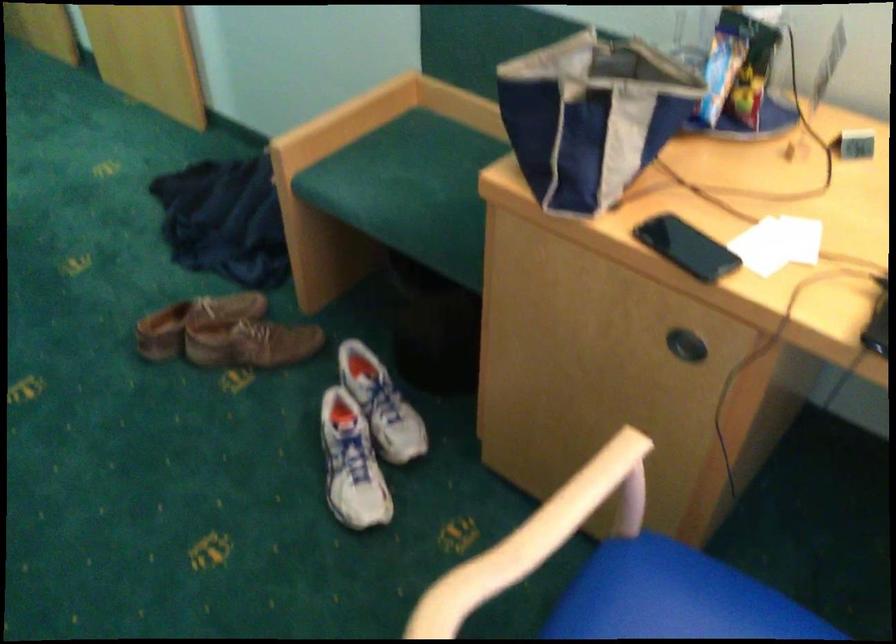
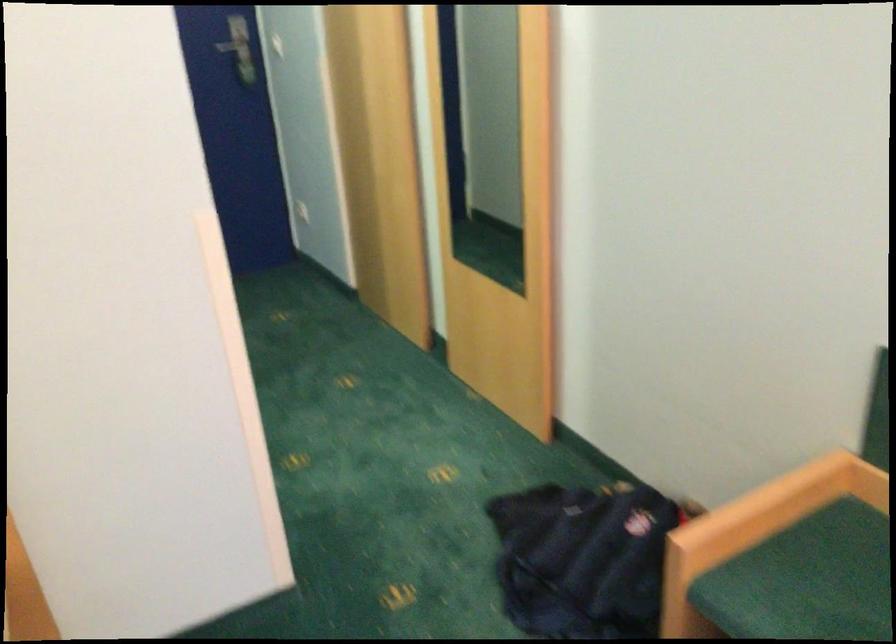
Question: Based on the continuous images, in which direction is the camera rotating? Reply with the corresponding letter.

Choices:
 (A) Left
 (B) Right
 (C) Up
 (D) Down

Answer: (A)